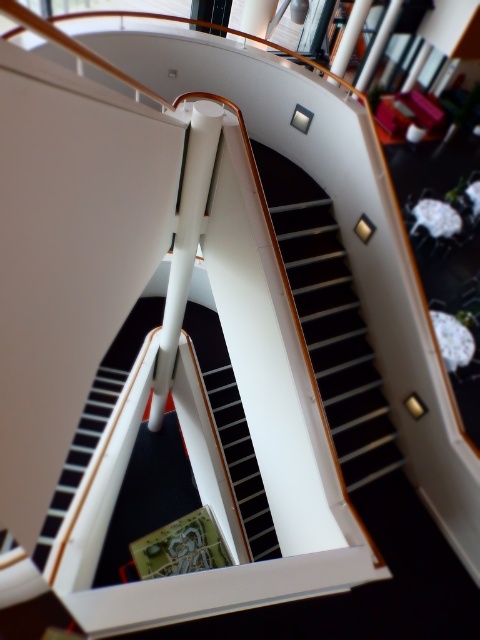
Between wooden stair at center and black glossy stair at center, which one has more height?

With more height is wooden stair at center.

Which of these two, wooden stair at center or black glossy stair at center, stands shorter?

Standing shorter between the two is black glossy stair at center.

This screenshot has height=640, width=480. What do you see at coordinates (336, 337) in the screenshot?
I see `wooden stair at center` at bounding box center [336, 337].

In order to click on wooden stair at center in this screenshot , I will do `click(336, 337)`.